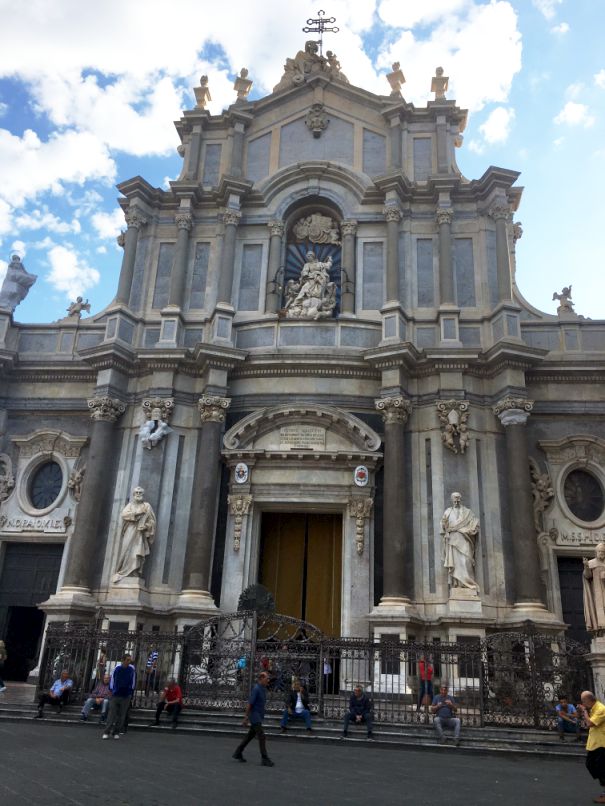
The image size is (605, 806). In order to click on entrance in this screenshot , I will do `click(289, 593)`, `click(316, 596)`.